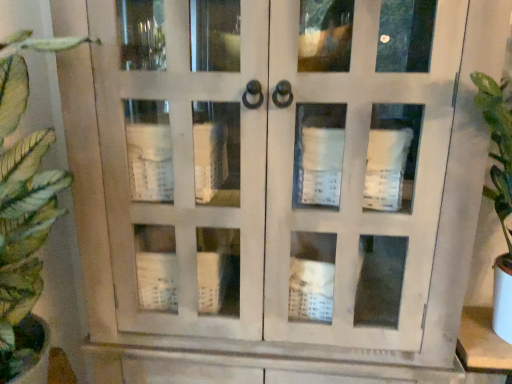
In order to face green leafy plant at left, should I rotate leftwards or rightwards?

It's best to rotate left around 26.171 degrees.

Where is `green leafy plant at left`? green leafy plant at left is located at coordinates (24, 236).

What do you see at coordinates (24, 236) in the screenshot? This screenshot has height=384, width=512. I see `green leafy plant at left` at bounding box center [24, 236].

Locate an element on the screen. green leafy plant at left is located at coordinates (24, 236).